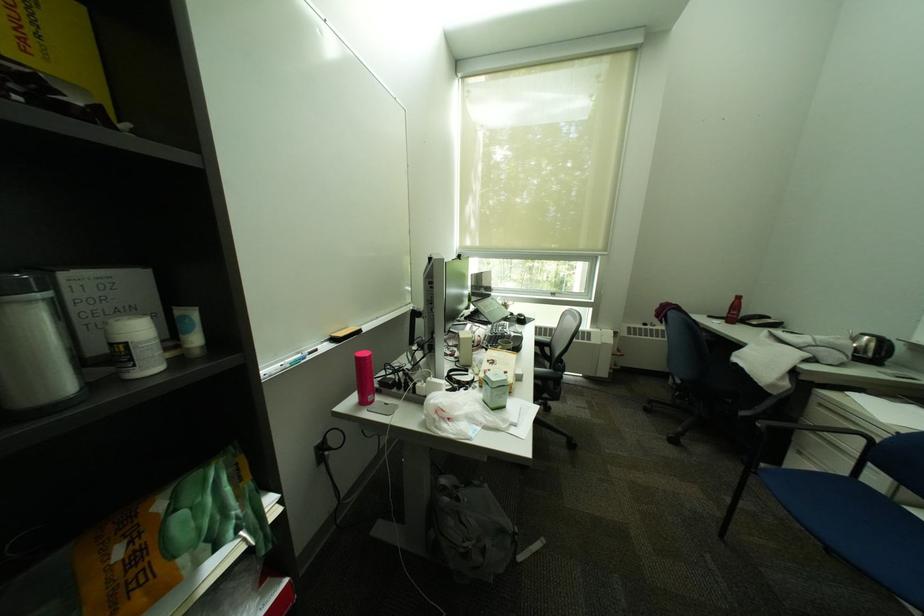
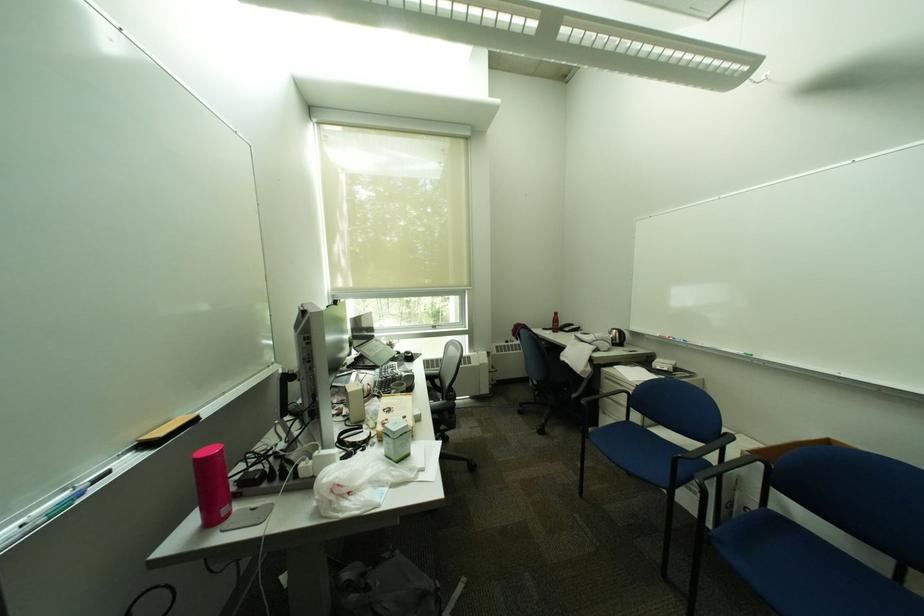
Where in the second image is the point corresponding to point 500,371 from the first image?

(397, 421)